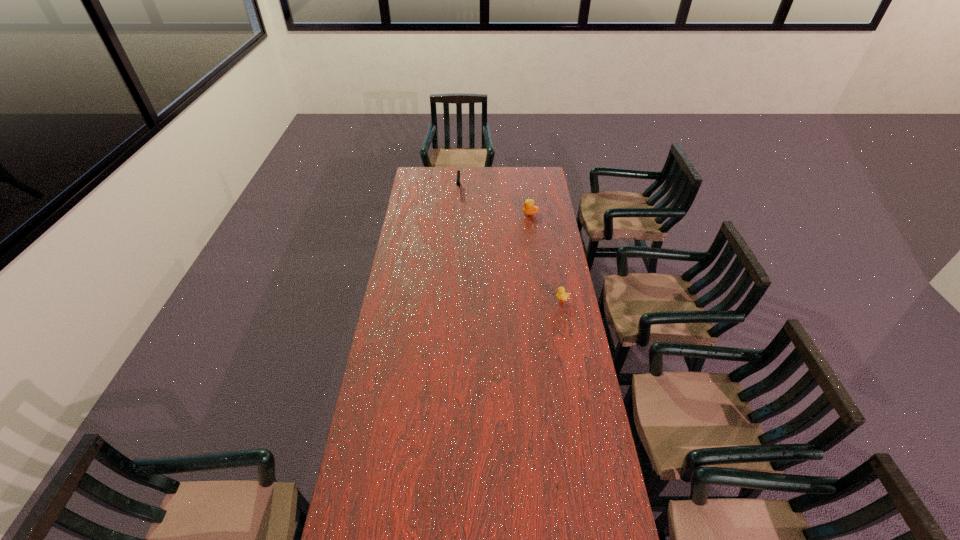
At what (x,y) coordinates should I click in order to perform the action: click on free spot located on the front-facing side of the rightmost object. Please return your answer as a coordinate pair (x, y). This screenshot has width=960, height=540. Looking at the image, I should click on (532, 300).

Find the location of a particular element. This screenshot has width=960, height=540. vacant space located 0.070m on the front-facing side of the rightmost object is located at coordinates [x=539, y=300].

Where is `free region located on the front-facing side of the rightmost object`? The height and width of the screenshot is (540, 960). free region located on the front-facing side of the rightmost object is located at coordinates (525, 300).

Where is `object that is at the far edge`? The height and width of the screenshot is (540, 960). object that is at the far edge is located at coordinates (458, 183).

I want to click on vacant space at the far edge, so click(489, 181).

Find the location of a particular element. vacant space at the left edge of the desktop is located at coordinates (425, 225).

In the image, there is a desktop. Where is `free space at the right edge`? Image resolution: width=960 pixels, height=540 pixels. free space at the right edge is located at coordinates (558, 280).

This screenshot has width=960, height=540. I want to click on free point between the pistol and the second object from left to right, so click(494, 201).

Identify the location of free space between the second object from right to left and the pistol. (494, 201).

Where is `vacant region between the nearer duckling and the leftmost object`? vacant region between the nearer duckling and the leftmost object is located at coordinates (510, 245).